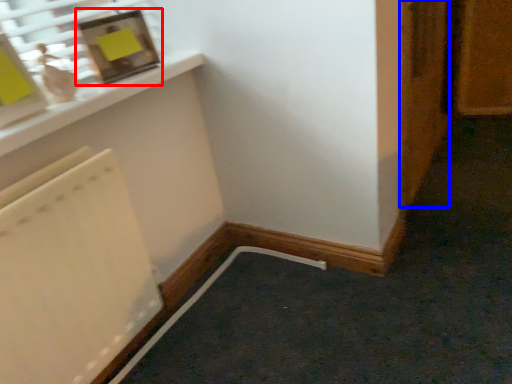
Question: Which point is closer to the camera, picture frame (highlighted by a red box) or door (highlighted by a blue box)?

Choices:
 (A) picture frame
 (B) door

Answer: (A)